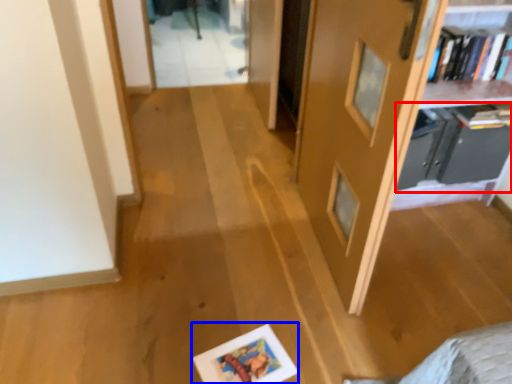
Question: Which point is closer to the camera, shelf (highlighted by a red box) or picture frame (highlighted by a blue box)?

Choices:
 (A) shelf
 (B) picture frame

Answer: (B)